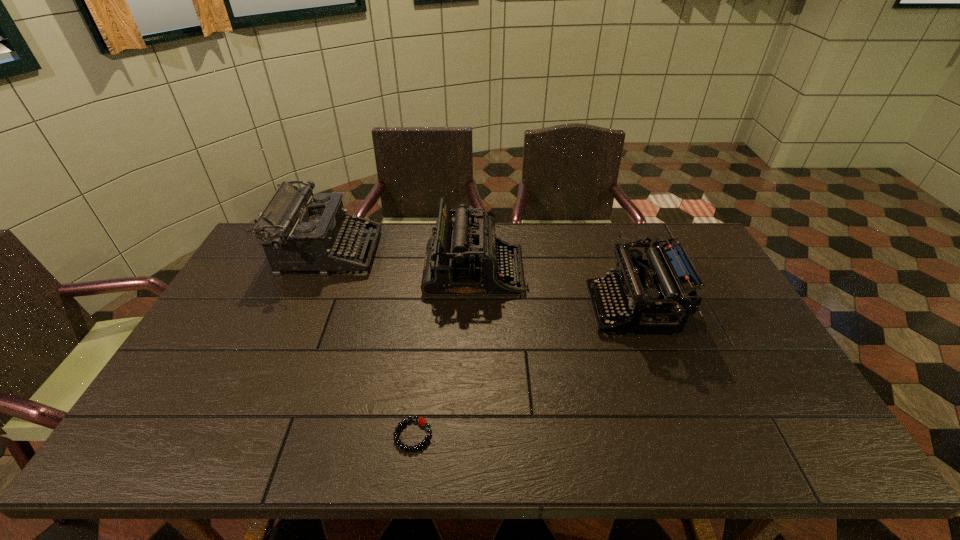
In order to click on unoccupied area between the leftmost typewriter and the shortest object in this screenshot , I will do `click(371, 343)`.

At what (x,y) coordinates should I click in order to perform the action: click on vacant space in between the second typewriter from right to left and the leftmost typewriter. Please return your answer as a coordinate pair (x, y). This screenshot has height=540, width=960. Looking at the image, I should click on (401, 262).

Where is `free space between the shortest object and the rightmost typewriter`? The image size is (960, 540). free space between the shortest object and the rightmost typewriter is located at coordinates (522, 372).

The height and width of the screenshot is (540, 960). Identify the location of unoccupied area between the second typewriter from left to right and the rightmost object. (554, 291).

This screenshot has height=540, width=960. In order to click on free space between the second typewriter from left to right and the leftmost typewriter in this screenshot , I will do `click(401, 262)`.

Find the location of `free point between the second typewriter from right to left and the rightmost object`. free point between the second typewriter from right to left and the rightmost object is located at coordinates (554, 291).

This screenshot has height=540, width=960. Identify the location of free point between the rightmost object and the shortest object. (522, 372).

Where is `the third closest object to the second typewriter from left to right`? Image resolution: width=960 pixels, height=540 pixels. the third closest object to the second typewriter from left to right is located at coordinates (421, 420).

Locate an element on the screen. The image size is (960, 540). object that is the nearest to the second typewriter from right to left is located at coordinates (304, 231).

Locate an element on the screen. typewriter that is the second closest to the rightmost object is located at coordinates (304, 231).